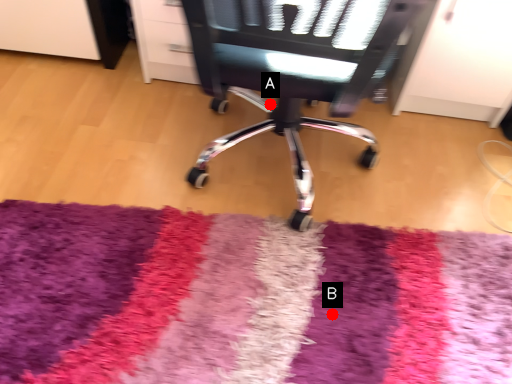
Question: Two points are circled on the image, labeled by A and B beside each circle. Among these points, which one is nearest to the camera?

Choices:
 (A) A is closer
 (B) B is closer

Answer: (B)